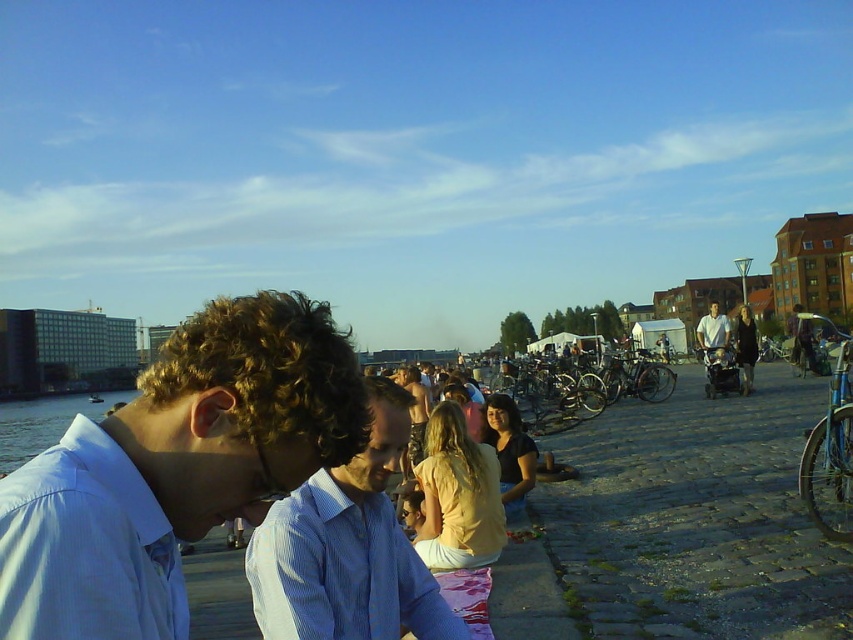
Question: Does blue metallic bicycle at right have a smaller size compared to blue water at lower left?

Choices:
 (A) no
 (B) yes

Answer: (B)

Question: Which point is farther from the camera taking this photo?

Choices:
 (A) (450, 614)
 (B) (822, 444)

Answer: (B)

Question: Does metallic blue bicycle at center-right come in front of light blue shirt at center?

Choices:
 (A) yes
 (B) no

Answer: (A)

Question: Does white shirt at center appear on the right side of blue metallic bicycle at right?

Choices:
 (A) no
 (B) yes

Answer: (A)

Question: Which object is positioned farthest from the white shirt at center?

Choices:
 (A) blue metallic bicycle at right
 (B) blue striped shirt at center
 (C) blue water at lower left
 (D) metallic blue bicycle at center-right

Answer: (C)

Question: Which is farther from the blue metallic bicycle at right?

Choices:
 (A) white shirt at center
 (B) blue water at lower left
 (C) light blue shirt at center
 (D) blue striped shirt at center

Answer: (B)